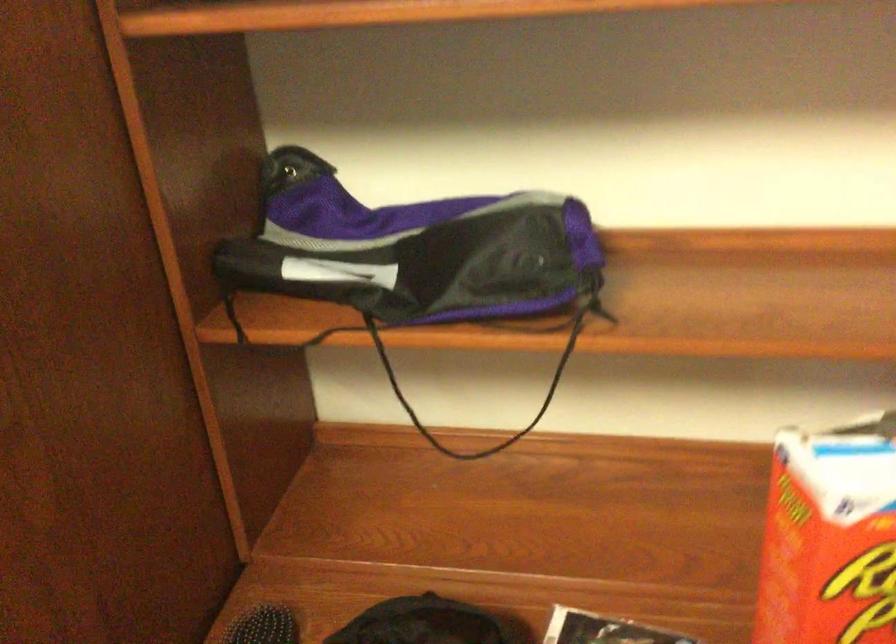
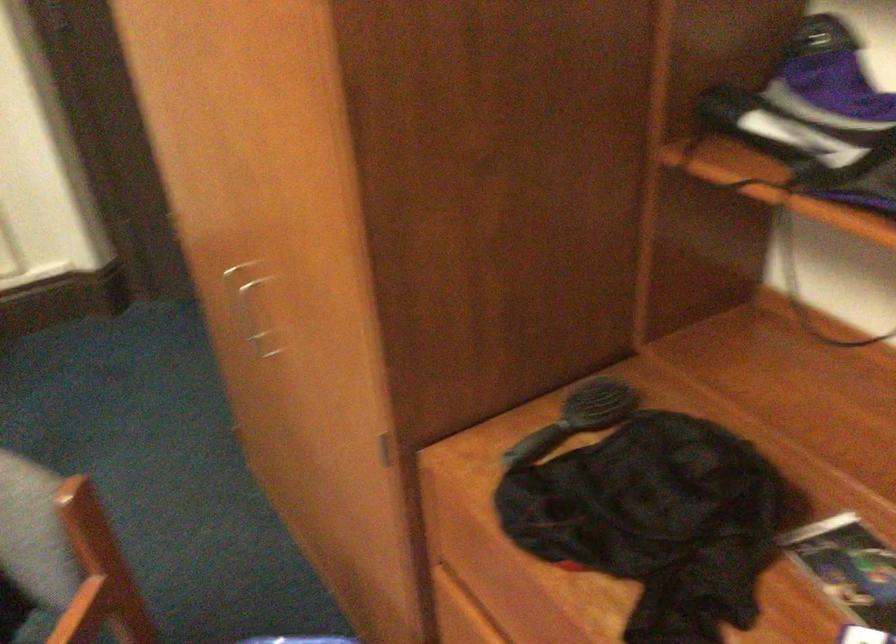
Based on the continuous images, in which direction is the camera rotating?

The camera rotated toward left-down.